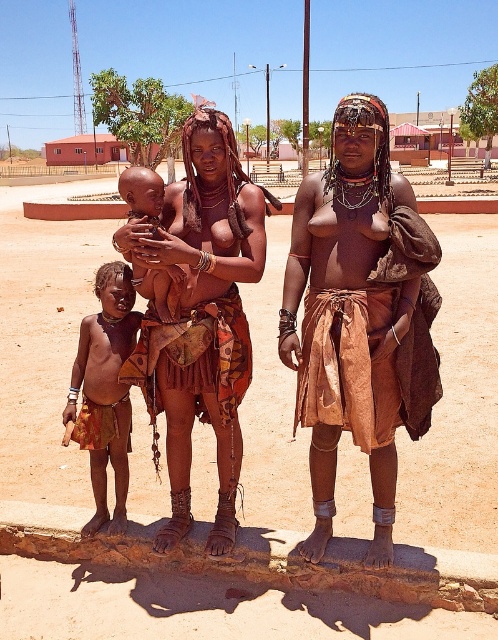
Question: Which of the following is the farthest from the observer?

Choices:
 (A) (183, 266)
 (B) (93, 380)
 (C) (385, 486)

Answer: (B)

Question: Among these points, which one is farthest from the camera?

Choices:
 (A) (70, 605)
 (B) (122, 179)
 (C) (418, 269)

Answer: (A)

Question: Is matte brown leather skirt at center further to camera compared to dark skin baby at center?

Choices:
 (A) no
 (B) yes

Answer: (B)

Question: From the image, what is the correct spatial relationship of matte orange skirt at lower left in relation to dark skin baby at center?

Choices:
 (A) right
 (B) left

Answer: (A)

Question: From the image, what is the correct spatial relationship of brown leather skirt at center in relation to matte brown leather skirt at center?

Choices:
 (A) above
 (B) below

Answer: (A)

Question: Which object is the farthest from the dirt field at center?

Choices:
 (A) dark skin baby at center
 (B) matte brown leather skirt at center

Answer: (A)